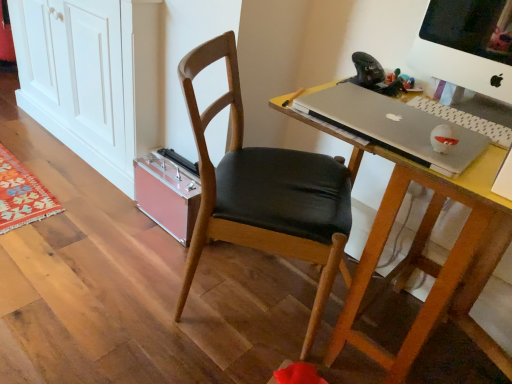
The width and height of the screenshot is (512, 384). Find the location of `blank area beneath wooden chair at center (from a real-world perspective)`. blank area beneath wooden chair at center (from a real-world perspective) is located at coordinates (233, 282).